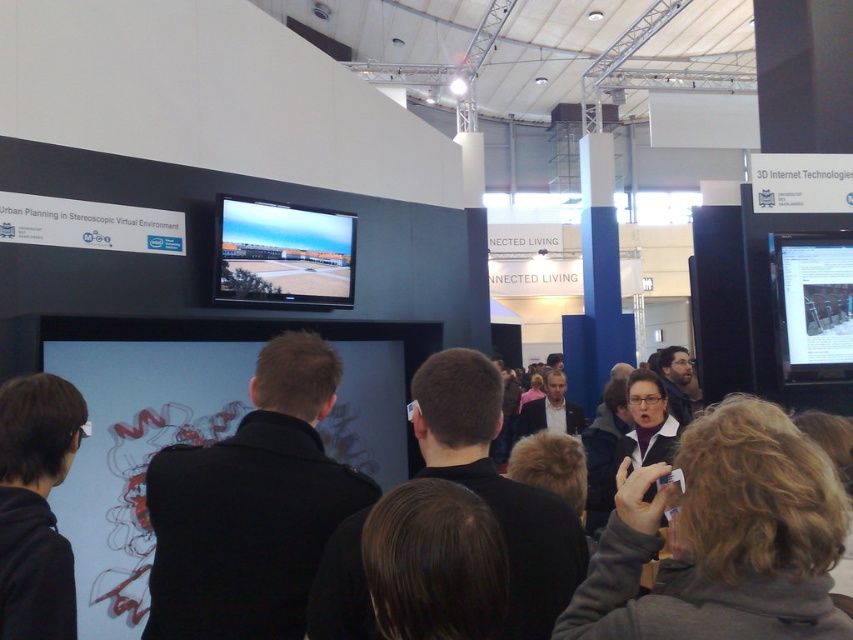
You are an attendee at the exhibition. You notice the black matte jacket at lower left and the matte black screen at upper center. Which object takes up more space in the image?

The matte black screen at upper center takes up more space in the image than the black matte jacket at lower left.

You are navigating through the exhibition space and need to locate two points marked on the floor. The first point is at coordinate point (277, 502) and the second is at point (28, 570). Which point is closer to you as you stand facing the screen?

Point (277, 502) is closer to you because it is further to the viewer than point (28, 570).

Based on the photo, you are a security guard standing at the entrance of the exhibition hall. You need to ensure that the black matte jacket at center and the matte black screen at upper center are within a 3 meter safety distance. Can you confirm if they are within the required distance?

The black matte jacket at center is 2.49 meters away from the matte black screen at upper center, so yes, they are within the required 3 meter safety distance.